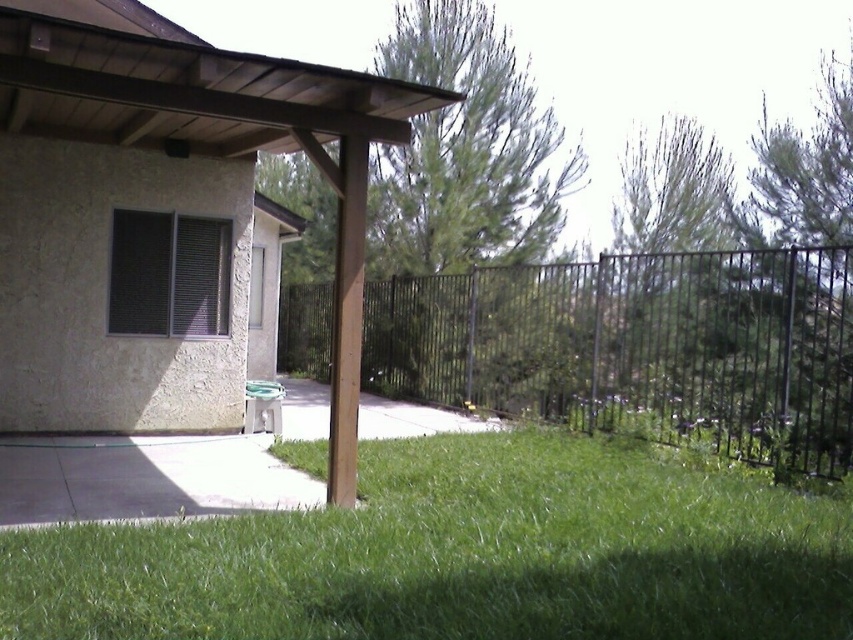
Question: Can you confirm if green grass at lower center is thinner than brown wood pergola at center?

Choices:
 (A) no
 (B) yes

Answer: (A)

Question: Where is green grass at lower center located in relation to black metal fence at center in the image?

Choices:
 (A) right
 (B) left

Answer: (A)

Question: Which object is positioned closest to the black metal fence at center?

Choices:
 (A) green grass at lower center
 (B) brown wood pergola at center

Answer: (A)

Question: Does brown wood pergola at center have a smaller size compared to black metal fence at center?

Choices:
 (A) no
 (B) yes

Answer: (B)

Question: Which point is closer to the camera taking this photo?

Choices:
 (A) (364, 465)
 (B) (196, 300)

Answer: (A)

Question: Which object appears farthest from the camera in this image?

Choices:
 (A) green grass at lower center
 (B) black metal fence at center
 (C) brown wood pergola at center

Answer: (B)